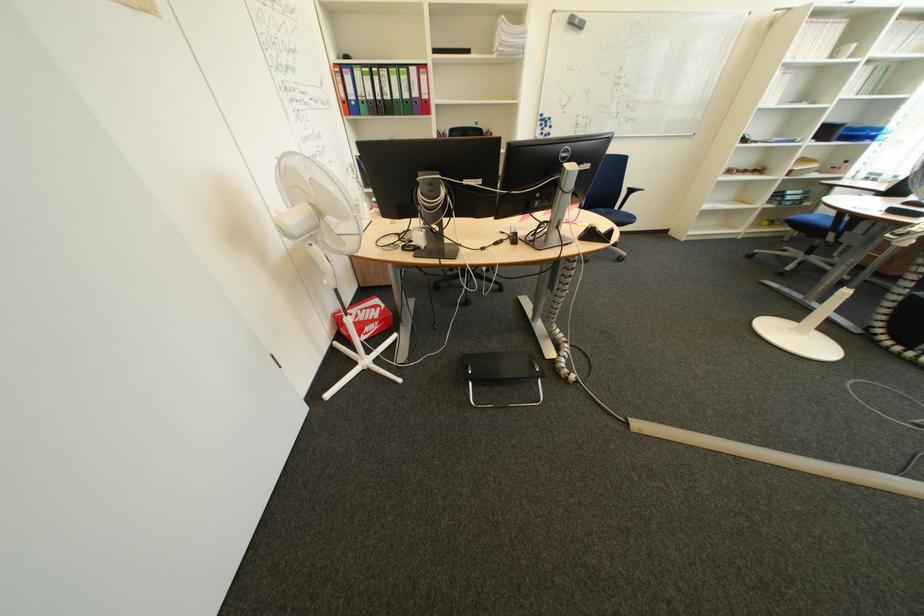
You are a GUI agent. You are given a task and a screenshot of the screen. Output one action in this format:
    pyautogui.click(x=<x>, y=<y>)
    Task: Click on the fan control buttons
    The image size is (924, 616).
    Given the screenshot: What is the action you would take?
    pyautogui.click(x=552, y=241)